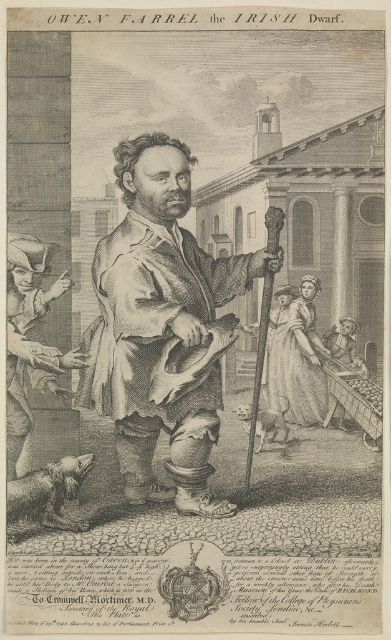
Can you confirm if matte brown coat at center is positioned above silky white gown at center?

Indeed, matte brown coat at center is positioned over silky white gown at center.

Is matte brown coat at center bigger than silky white gown at center?

Indeed, matte brown coat at center has a larger size compared to silky white gown at center.

Where is `matte brown coat at center`? matte brown coat at center is located at coordinates (161, 326).

In the scene shown: Between smooth skin figure at lower left and silky white gown at center, which one is positioned lower?

silky white gown at center

Is point (8, 440) positioned before point (286, 291)?

Yes, it is.

The width and height of the screenshot is (391, 640). I want to click on smooth skin figure at lower left, so click(30, 340).

Between matte brown coat at center and smooth skin figure at lower left, which one is positioned higher?

matte brown coat at center

What do you see at coordinates (161, 326) in the screenshot?
I see `matte brown coat at center` at bounding box center [161, 326].

The height and width of the screenshot is (640, 391). I want to click on matte brown coat at center, so click(x=161, y=326).